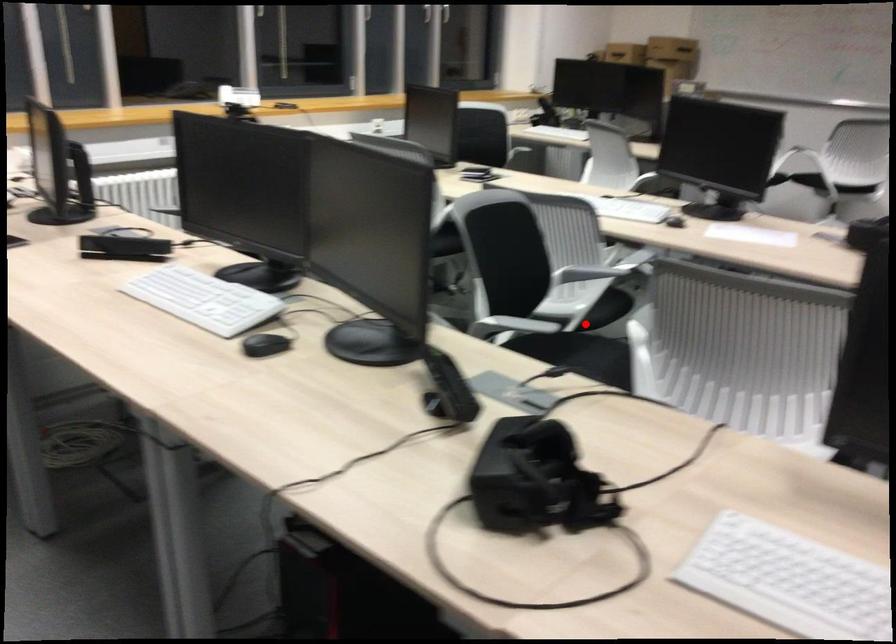
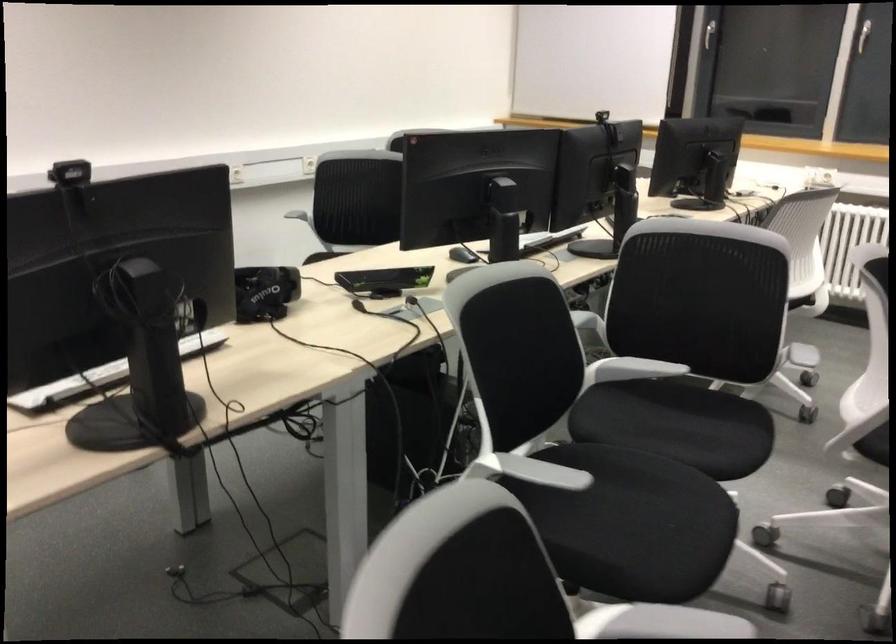
Locate, in the second image, the point that corresponds to the highlighted location in the first image.

(874, 444)